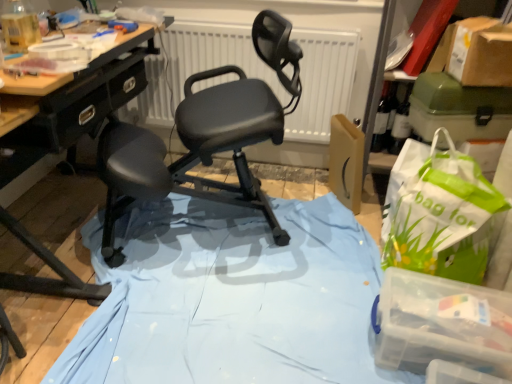
Identify the location of vacant area situated below white matte radiator at center (from a real-world perspective). (254, 161).